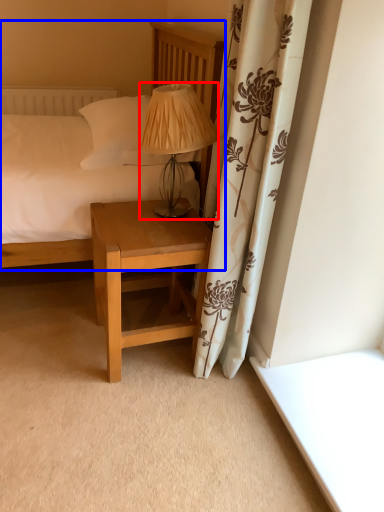
Question: Which point is closer to the camera, table lamp (highlighted by a red box) or bed (highlighted by a blue box)?

Choices:
 (A) table lamp
 (B) bed

Answer: (B)